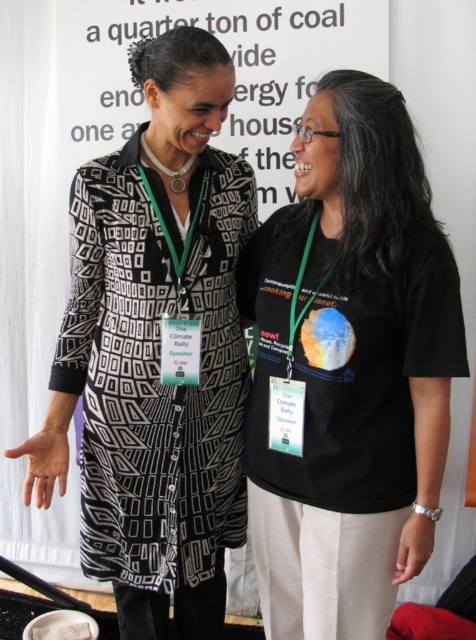
Question: Which of the following is the closest to the observer?

Choices:
 (A) (117, 385)
 (B) (258, 388)

Answer: (B)

Question: Does black matte t-shirt at center appear on the right side of black printed dress at left?

Choices:
 (A) yes
 (B) no

Answer: (A)

Question: Is black matte t-shirt at center wider than black printed dress at left?

Choices:
 (A) yes
 (B) no

Answer: (B)

Question: Which point appears farthest from the camera in this image?

Choices:
 (A) (445, 435)
 (B) (245, 387)

Answer: (B)

Question: In this image, where is black matte t-shirt at center located relative to black printed dress at left?

Choices:
 (A) above
 (B) below

Answer: (B)

Question: Among these objects, which one is farthest from the camera?

Choices:
 (A) black printed dress at left
 (B) black matte t-shirt at center

Answer: (A)